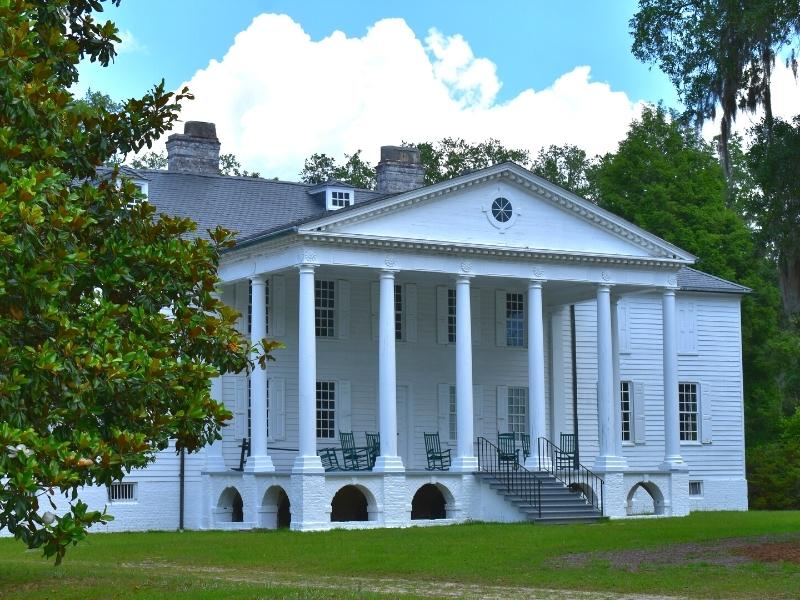
Where is `rocking chairs`? The image size is (800, 600). rocking chairs is located at coordinates 441,456, 357,460, 372,438, 517,446.